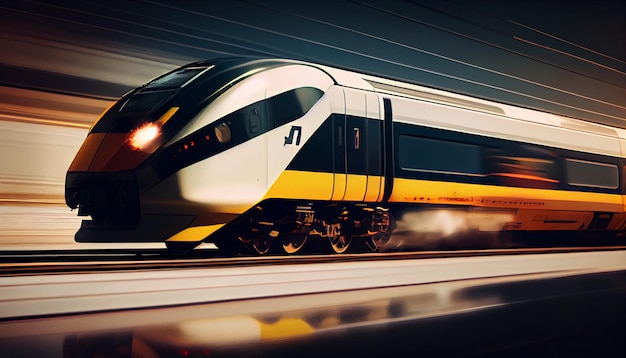
Where is `the front windows`? The image size is (626, 358). the front windows is located at coordinates (143, 100), (168, 75).